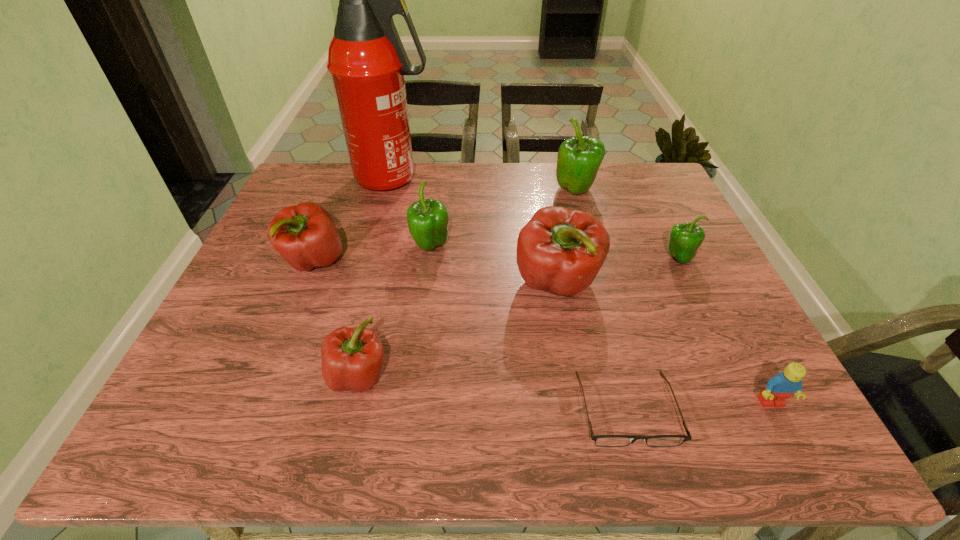
I want to click on free space located on the right of the nearest pink bell pepper, so click(x=468, y=376).

Find the location of a particular element. free region located 0.050m on the face of the Lego is located at coordinates (789, 436).

Where is `fire extinguisher at the far edge`? The image size is (960, 540). fire extinguisher at the far edge is located at coordinates (366, 58).

Find the location of a particular element. This screenshot has height=540, width=960. bell pepper that is at the far edge is located at coordinates (578, 161).

Identify the location of Lego present at the near edge. The image size is (960, 540). (785, 384).

I want to click on spectacles present at the near edge, so click(600, 440).

This screenshot has height=540, width=960. I want to click on object positioned at the left edge, so click(x=305, y=235).

In order to click on bell pepper located in the right edge section of the desktop in this screenshot , I will do `click(684, 240)`.

Image resolution: width=960 pixels, height=540 pixels. Identify the location of Lego located at the right edge. (785, 384).

Where is `object present at the near right corner`? The width and height of the screenshot is (960, 540). object present at the near right corner is located at coordinates (785, 384).